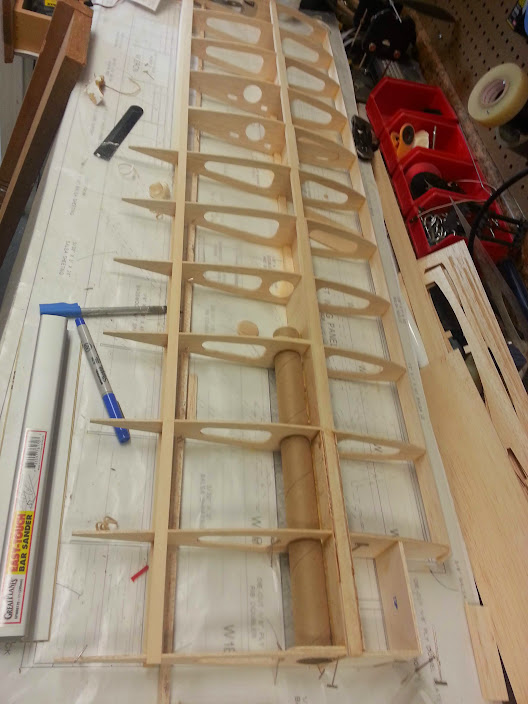
In order to click on toilet paper rolls in this screenshot , I will do `click(311, 586)`, `click(308, 510)`, `click(300, 408)`.